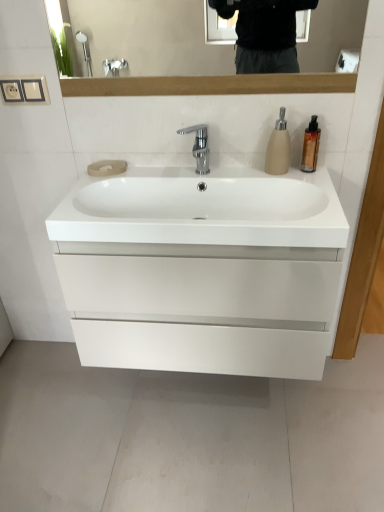
You are a GUI agent. You are given a task and a screenshot of the screen. Output one action in this format:
    pyautogui.click(x=<x>, y=<y>)
    Task: Click on the vacant space to the right of polished chrome faucet at center
    The image size is (384, 512).
    Given the screenshot: What is the action you would take?
    pyautogui.click(x=242, y=168)